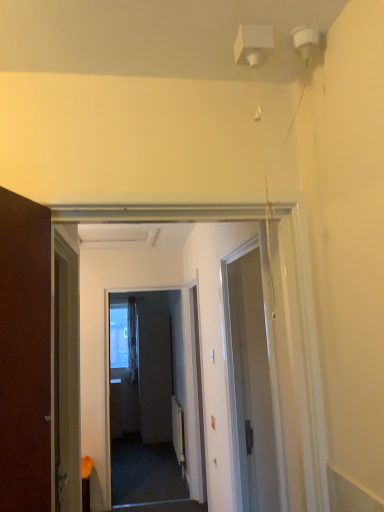
Question: From the image's perspective, does matte gray screen door at center appear higher than white sheer curtain at center?

Choices:
 (A) yes
 (B) no

Answer: (B)

Question: Is matte gray screen door at center looking in the opposite direction of white sheer curtain at center?

Choices:
 (A) no
 (B) yes

Answer: (A)

Question: Considering the relative sizes of matte gray screen door at center and white sheer curtain at center in the image provided, is matte gray screen door at center shorter than white sheer curtain at center?

Choices:
 (A) yes
 (B) no

Answer: (B)

Question: From a real-world perspective, is matte gray screen door at center physically above white sheer curtain at center?

Choices:
 (A) yes
 (B) no

Answer: (B)

Question: Is the position of matte gray screen door at center more distant than that of white sheer curtain at center?

Choices:
 (A) no
 (B) yes

Answer: (A)

Question: From the image's perspective, is matte gray screen door at center beneath white sheer curtain at center?

Choices:
 (A) no
 (B) yes

Answer: (B)

Question: From the image's perspective, is white glossy door at center below matte gray screen door at center?

Choices:
 (A) yes
 (B) no

Answer: (B)

Question: Is the depth of white glossy door at center less than that of matte gray screen door at center?

Choices:
 (A) yes
 (B) no

Answer: (A)

Question: Considering the relative sizes of white glossy door at center and matte gray screen door at center in the image provided, is white glossy door at center taller than matte gray screen door at center?

Choices:
 (A) yes
 (B) no

Answer: (B)

Question: Does white glossy door at center have a larger size compared to matte gray screen door at center?

Choices:
 (A) no
 (B) yes

Answer: (A)

Question: Considering the relative sizes of white glossy door at center and matte gray screen door at center in the image provided, is white glossy door at center thinner than matte gray screen door at center?

Choices:
 (A) no
 (B) yes

Answer: (B)

Question: From a real-world perspective, is white glossy door at center on top of matte gray screen door at center?

Choices:
 (A) yes
 (B) no

Answer: (A)

Question: Can you confirm if white sheer curtain at center is wider than white glossy door at center?

Choices:
 (A) no
 (B) yes

Answer: (B)